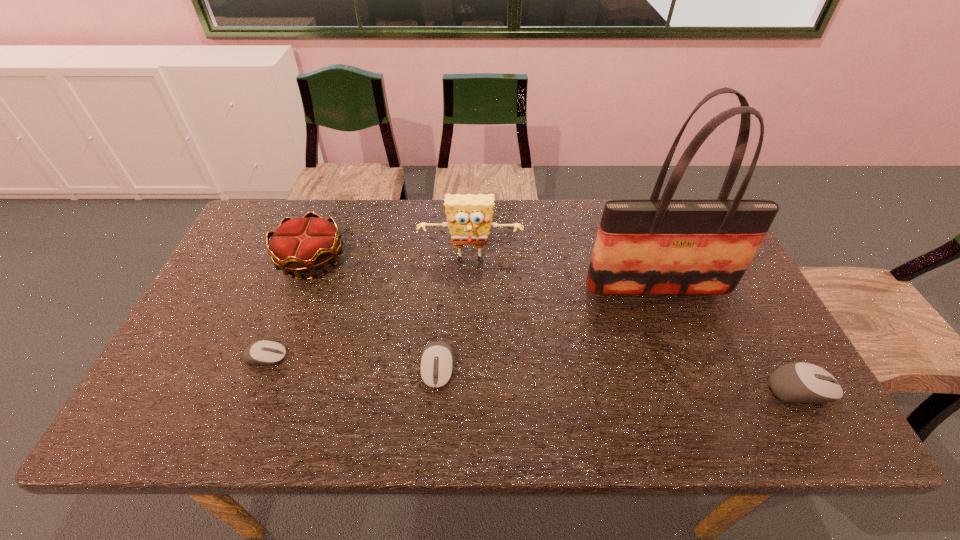
Identify the location of empty space that is in between the shortest object and the shopping bag. (463, 322).

The height and width of the screenshot is (540, 960). I want to click on free space that is in between the crown and the rightmost computer equipment, so click(x=557, y=325).

Locate an element on the screen. The width and height of the screenshot is (960, 540). unoccupied position between the fifth tallest object and the shopping bag is located at coordinates (548, 328).

At what (x,y) coordinates should I click in order to perform the action: click on unoccupied area between the shopping bag and the second tallest object. Please return your answer as a coordinate pair (x, y). This screenshot has width=960, height=540. Looking at the image, I should click on (564, 275).

Where is `object that is the third closest to the sponge`? Image resolution: width=960 pixels, height=540 pixels. object that is the third closest to the sponge is located at coordinates (436, 366).

Choose which object is the fourth nearest neighbor to the second computer equipment from right to left. Please provide its 2D coordinates. Your answer should be formatted as a tuple, i.e. [(x, y)], where the tuple contains the x and y coordinates of a point satisfying the conditions above.

[(666, 246)]

I want to click on computer equipment that is the nearest to the second tallest computer equipment, so click(263, 353).

Where is `computer equipment identified as the third closest to the shopping bag`? The height and width of the screenshot is (540, 960). computer equipment identified as the third closest to the shopping bag is located at coordinates (263, 353).

Where is `free space that satisfies the following two spatial constraints: 1. on the face of the sponge; 2. on the wheel side of the leftmost computer equipment`? The image size is (960, 540). free space that satisfies the following two spatial constraints: 1. on the face of the sponge; 2. on the wheel side of the leftmost computer equipment is located at coordinates (468, 357).